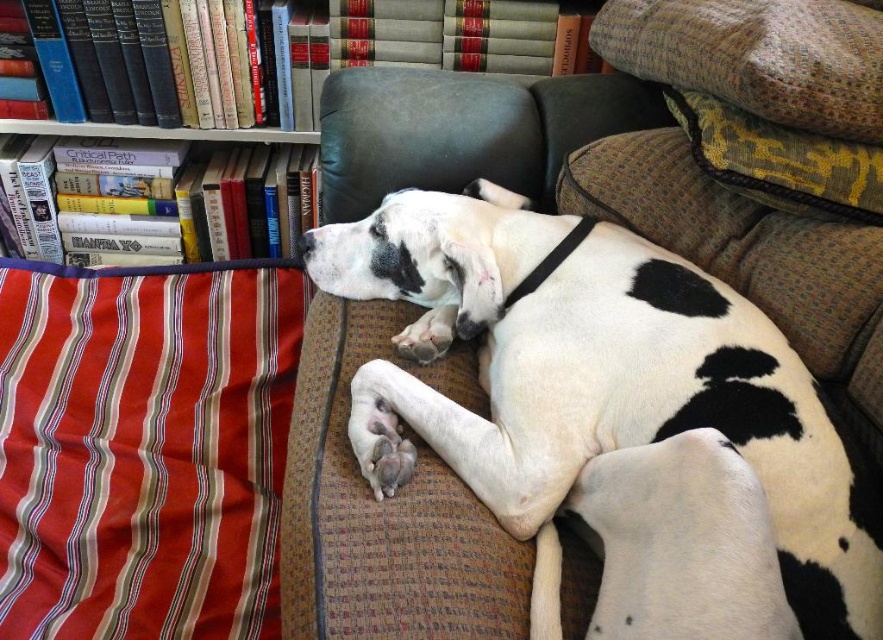
Question: Which of the following is the closest to the observer?

Choices:
 (A) (797, 160)
 (B) (240, 472)
 (C) (517, 285)

Answer: (A)

Question: Is white fur at center further to camera compared to patterned fabric pillow at upper right?

Choices:
 (A) no
 (B) yes

Answer: (A)

Question: Does striped fabric pillow at left appear under patterned fabric pillow at upper right?

Choices:
 (A) no
 (B) yes

Answer: (B)

Question: Which object is farther from the camera taking this photo?

Choices:
 (A) white fur at center
 (B) textured yellow-green pillow at upper right
 (C) hardcover books at upper left
 (D) patterned fabric pillow at upper right

Answer: (C)

Question: Can you confirm if white fur at center is positioned to the right of textured yellow-green pillow at upper right?

Choices:
 (A) yes
 (B) no

Answer: (B)

Question: Which object is farther from the camera taking this photo?

Choices:
 (A) striped fabric pillow at left
 (B) patterned fabric pillow at upper right
 (C) textured yellow-green pillow at upper right
 (D) hardcover books at upper left

Answer: (D)